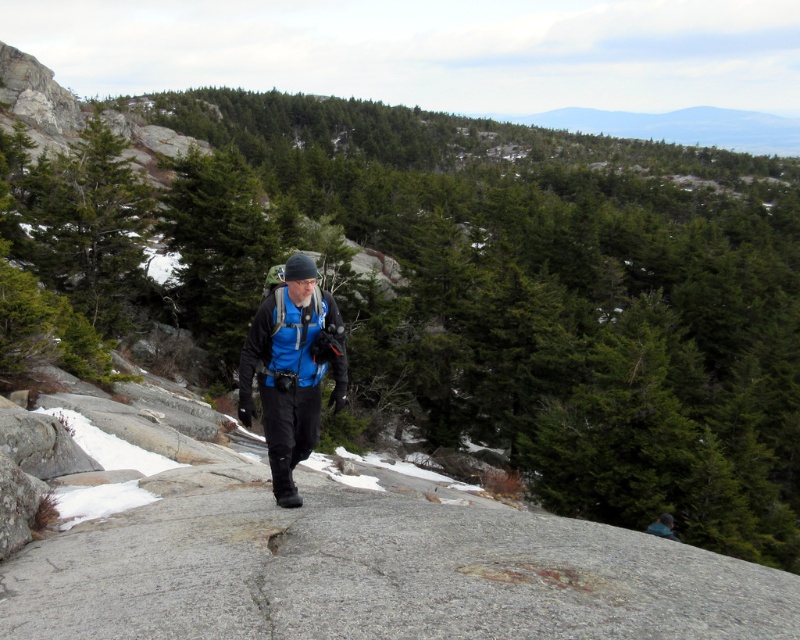
Locate an element on the screen. blue matte jacket at center is located at coordinates (292, 369).

What are the coordinates of `blue matte jacket at center` in the screenshot? It's located at (292, 369).

Where is `blue matte jacket at center`? This screenshot has height=640, width=800. blue matte jacket at center is located at coordinates (292, 369).